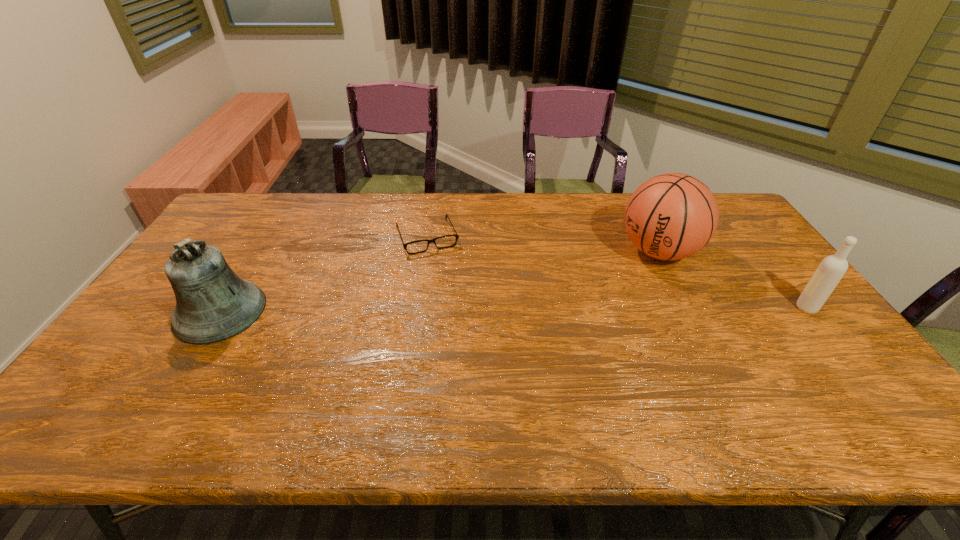
Find the location of a particular element. free space on the desktop that is between the leftmost object and the rightmost object and is positioned on the front-facing side of the spectacles is located at coordinates (456, 310).

You are a GUI agent. You are given a task and a screenshot of the screen. Output one action in this format:
    pyautogui.click(x=<x>, y=<y>)
    Task: Click on the free spot on the desktop that is between the leftmost object and the vodka and is positioned on the surface of the basketball near the brand logo
    The width and height of the screenshot is (960, 540).
    Given the screenshot: What is the action you would take?
    pyautogui.click(x=569, y=309)